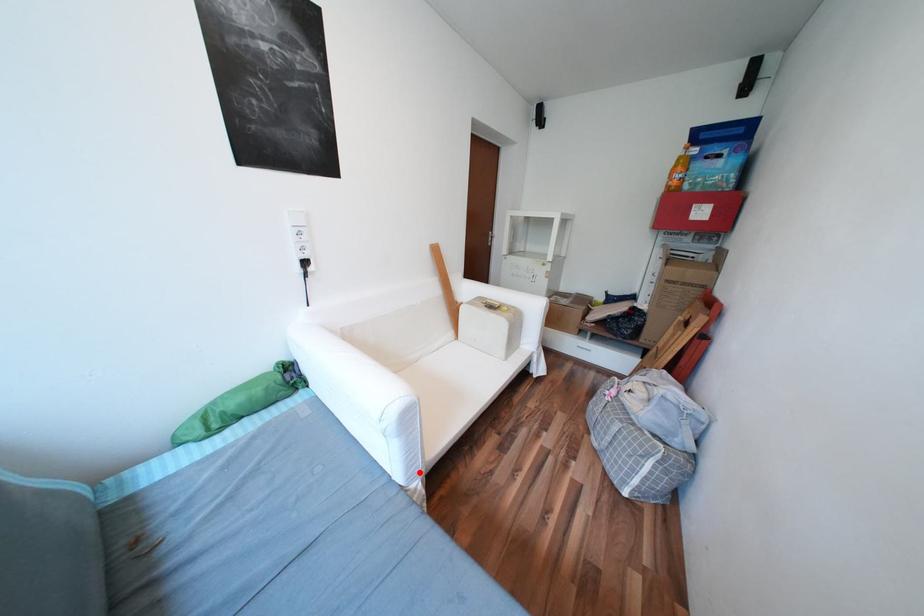
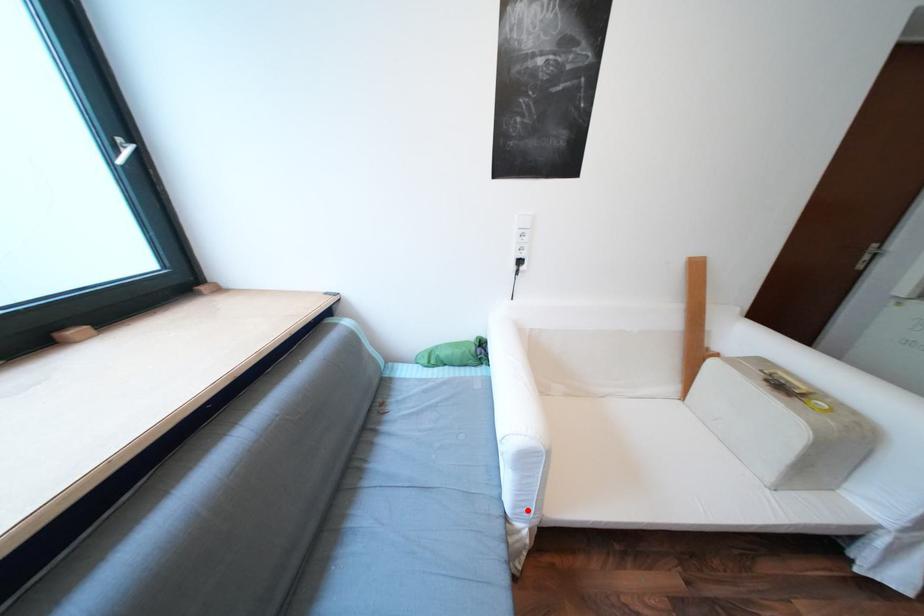
From the picture: I am providing you with two images of the same scene from different viewpoints. A red point is marked on the first image and another point is marked on the second image. Is the marked point in image1 the same physical position as the marked point in image2?

Result: Yes